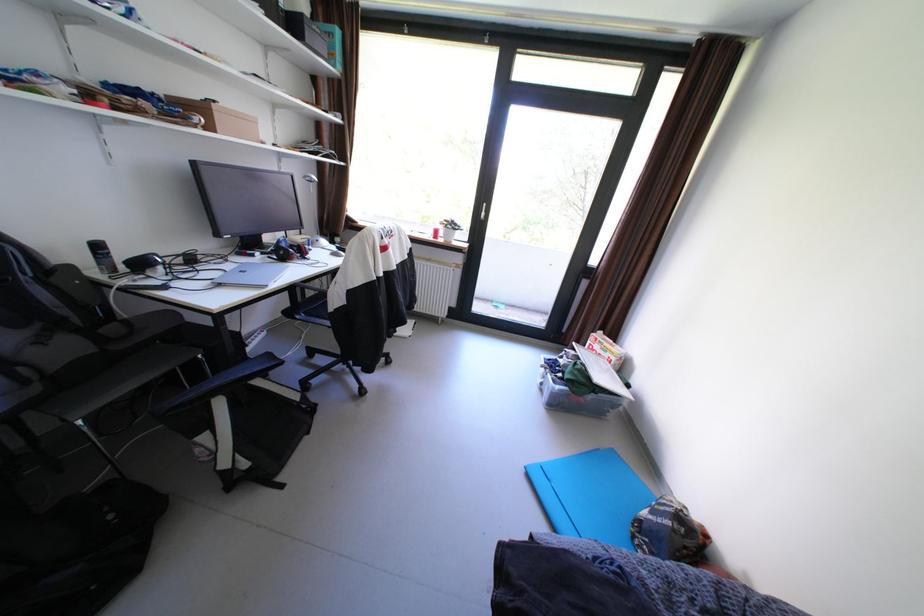
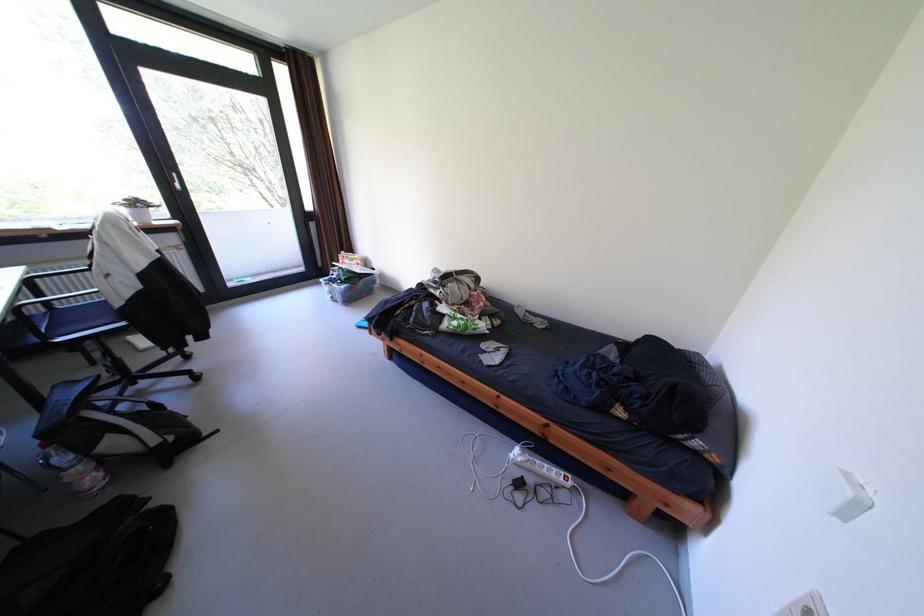
Find the pixel in the second image that matches pixel 581 373 in the first image.

(355, 275)